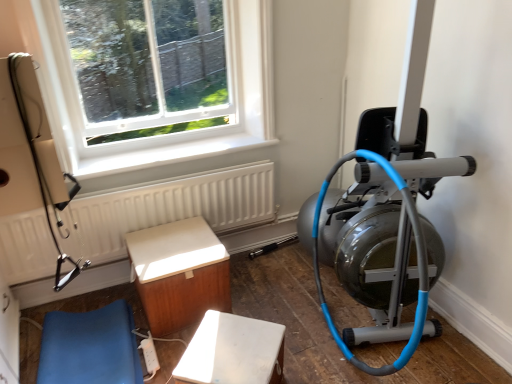
In order to click on white plastic extension cord at lower center in this screenshot , I will do `click(149, 356)`.

Looking at this image, how much space does wooden cabinet at lower left, which ranks as the second furniture in left-to-right order, occupy horizontally?

17.84 inches.

This screenshot has height=384, width=512. What do you see at coordinates (232, 351) in the screenshot? I see `white matte bench at lower center, marked as the 3th furniture in a left-to-right arrangement` at bounding box center [232, 351].

What is the approximate height of silver metallic stationary bicycle at right?

silver metallic stationary bicycle at right is 95.33 centimeters in height.

Image resolution: width=512 pixels, height=384 pixels. Describe the element at coordinates (381, 232) in the screenshot. I see `silver metallic stationary bicycle at right` at that location.

Describe the element at coordinates (163, 95) in the screenshot. I see `white plastic window at upper left` at that location.

You are a GUI agent. You are given a task and a screenshot of the screen. Output one action in this format:
    pyautogui.click(x=<x>, y=<y>)
    Task: Click on the white plastic extension cord at lower center
    
    Given the screenshot: What is the action you would take?
    [x=149, y=356]

You are a GUI agent. You are given a task and a screenshot of the screen. Output one action in this format:
    pyautogui.click(x=<x>, y=<y>)
    Task: Click on the extension cord located behind the white matte bench at lower center, marked as the 3th furniture in a left-to-right arrangement
    
    Given the screenshot: What is the action you would take?
    pyautogui.click(x=149, y=356)

Is point (148, 352) positioned behind point (249, 358)?

Yes, it is.

Which object is more forward, white plastic extension cord at lower center or white matte bench at lower center, the first furniture from the right?

white matte bench at lower center, the first furniture from the right, is more forward.

Does blue leather cushion at lower left, the first furniture when ordered from left to right, come behind wooden cabinet at lower left, which ranks as the second furniture in left-to-right order?

No, it is not.

Considering the relative sizes of blue leather cushion at lower left, the first furniture when ordered from left to right, and wooden cabinet at lower left, acting as the 2th furniture starting from the right, in the image provided, is blue leather cushion at lower left, the first furniture when ordered from left to right, bigger than wooden cabinet at lower left, acting as the 2th furniture starting from the right,?

Incorrect, blue leather cushion at lower left, the first furniture when ordered from left to right, is not larger than wooden cabinet at lower left, acting as the 2th furniture starting from the right.

Between blue leather cushion at lower left, the 3th furniture when ordered from right to left, and wooden cabinet at lower left, which ranks as the second furniture in left-to-right order, which one appears on the left side from the viewer's perspective?

blue leather cushion at lower left, the 3th furniture when ordered from right to left, is more to the left.

Considering the positions of objects white plastic extension cord at lower center and white plastic window at upper left in the image provided, who is in front, white plastic extension cord at lower center or white plastic window at upper left?

white plastic extension cord at lower center.

How different are the orientations of white plastic extension cord at lower center and white plastic window at upper left in degrees?

1.89 degrees.

From the picture: Is white plastic extension cord at lower center taller than white plastic window at upper left?

Incorrect, the height of white plastic extension cord at lower center is not larger of that of white plastic window at upper left.

From the image's perspective, is white matte bench at lower center, the first furniture from the right, located above or below blue leather cushion at lower left, the first furniture when ordered from left to right?

Based on their image positions, white matte bench at lower center, the first furniture from the right, is located beneath blue leather cushion at lower left, the first furniture when ordered from left to right.

Is white matte bench at lower center, the first furniture from the right, facing towards blue leather cushion at lower left, the 3th furniture when ordered from right to left?

No, white matte bench at lower center, the first furniture from the right, is not oriented towards blue leather cushion at lower left, the 3th furniture when ordered from right to left.

Which is behind, point (213, 314) or point (136, 357)?

The point (136, 357) is farther from the camera.

Which is nearer, (x=42, y=276) or (x=213, y=139)?

Point (x=42, y=276) is positioned closer to the camera compared to point (x=213, y=139).

From the image's perspective, is white textured radiator at upper left located above or below white plastic window at upper left?

white textured radiator at upper left is situated lower than white plastic window at upper left in the image.

You are a GUI agent. You are given a task and a screenshot of the screen. Output one action in this format:
    pyautogui.click(x=<x>, y=<y>)
    Task: Click on the radiator lying below the white plastic window at upper left (from the image's perspective)
    Image resolution: width=512 pixels, height=384 pixels.
    Given the screenshot: What is the action you would take?
    pyautogui.click(x=175, y=207)

Is white textured radiator at upper left positioned far away from white plastic window at upper left?

No, there isn't a large distance between white textured radiator at upper left and white plastic window at upper left.

In the scene shown: Is blue leather cushion at lower left, the 3th furniture when ordered from right to left, oriented towards white textured radiator at upper left?

No, blue leather cushion at lower left, the 3th furniture when ordered from right to left, is not oriented towards white textured radiator at upper left.

Does blue leather cushion at lower left, the first furniture when ordered from left to right, touch white textured radiator at upper left?

There is a gap between blue leather cushion at lower left, the first furniture when ordered from left to right, and white textured radiator at upper left.

Who is more distant, blue leather cushion at lower left, the first furniture when ordered from left to right, or white textured radiator at upper left?

white textured radiator at upper left is more distant.

Is blue leather cushion at lower left, the first furniture when ordered from left to right, bigger or smaller than white textured radiator at upper left?

Clearly, blue leather cushion at lower left, the first furniture when ordered from left to right, is smaller in size than white textured radiator at upper left.

Can you confirm if white plastic window at upper left is positioned to the left of white textured radiator at upper left?

No, white plastic window at upper left is not to the left of white textured radiator at upper left.

Based on the photo, which of these two, white plastic window at upper left or white textured radiator at upper left, is smaller?

Smaller between the two is white plastic window at upper left.

From a real-world perspective, is white plastic window at upper left positioned over white textured radiator at upper left based on gravity?

Yes, from a real-world perspective, white plastic window at upper left is over white textured radiator at upper left

In terms of width, does white plastic window at upper left look wider or thinner when compared to white textured radiator at upper left?

Considering their sizes, white plastic window at upper left looks slimmer than white textured radiator at upper left.

This screenshot has height=384, width=512. Identify the location of extension cord located on the left of white matte bench at lower center, marked as the 3th furniture in a left-to-right arrangement. (149, 356).

Locate an element on the screen. The height and width of the screenshot is (384, 512). the 2nd furniture directly above the blue leather cushion at lower left, the first furniture when ordered from left to right (from a real-world perspective) is located at coordinates (179, 273).

When comparing their distances from silver metallic stationary bicycle at right, does white matte bench at lower center, the first furniture from the right, or blue leather cushion at lower left, the first furniture when ordered from left to right, seem closer?

white matte bench at lower center, the first furniture from the right, is closer to silver metallic stationary bicycle at right.

Which object lies nearer to the anchor point white plastic window at upper left, wooden cabinet at lower left, which ranks as the second furniture in left-to-right order, or silver metallic stationary bicycle at right?

wooden cabinet at lower left, which ranks as the second furniture in left-to-right order, is positioned closer to the anchor white plastic window at upper left.

Based on their spatial positions, is silver metallic stationary bicycle at right or white matte bench at lower center, the first furniture from the right, closer to white textured radiator at upper left?

white matte bench at lower center, the first furniture from the right, lies closer to white textured radiator at upper left than the other object.

Estimate the real-world distances between objects in this image. Which object is further from white textured radiator at upper left, white plastic extension cord at lower center or silver metallic stationary bicycle at right?

silver metallic stationary bicycle at right is positioned further to the anchor white textured radiator at upper left.

When comparing their distances from silver metallic stationary bicycle at right, does wooden cabinet at lower left, acting as the 2th furniture starting from the right, or white textured radiator at upper left seem further?

white textured radiator at upper left is further to silver metallic stationary bicycle at right.

Considering their positions, is silver metallic stationary bicycle at right positioned further to white plastic extension cord at lower center than white matte bench at lower center, marked as the 3th furniture in a left-to-right arrangement?

silver metallic stationary bicycle at right is positioned further to the anchor white plastic extension cord at lower center.

From the image, which object appears to be farther from blue leather cushion at lower left, the 3th furniture when ordered from right to left, white plastic extension cord at lower center or silver metallic stationary bicycle at right?

silver metallic stationary bicycle at right lies further to blue leather cushion at lower left, the 3th furniture when ordered from right to left, than the other object.

When comparing their distances from white textured radiator at upper left, does silver metallic stationary bicycle at right or white plastic window at upper left seem closer?

Among the two, white plastic window at upper left is located nearer to white textured radiator at upper left.

Where is `extension cord between blue leather cushion at lower left, the first furniture when ordered from left to right, and white matte bench at lower center, marked as the 3th furniture in a left-to-right arrangement, from left to right`? The width and height of the screenshot is (512, 384). extension cord between blue leather cushion at lower left, the first furniture when ordered from left to right, and white matte bench at lower center, marked as the 3th furniture in a left-to-right arrangement, from left to right is located at coordinates (149, 356).

The height and width of the screenshot is (384, 512). I want to click on extension cord located between blue leather cushion at lower left, the 3th furniture when ordered from right to left, and silver metallic stationary bicycle at right in the left-right direction, so click(x=149, y=356).

At what (x,y) coordinates should I click in order to perform the action: click on furniture situated between wooden cabinet at lower left, which ranks as the second furniture in left-to-right order, and silver metallic stationary bicycle at right from left to right. Please return your answer as a coordinate pair (x, y). Looking at the image, I should click on (232, 351).

The height and width of the screenshot is (384, 512). I want to click on stationary bicycle between white plastic window at upper left and white matte bench at lower center, marked as the 3th furniture in a left-to-right arrangement, in the up-down direction, so click(381, 232).